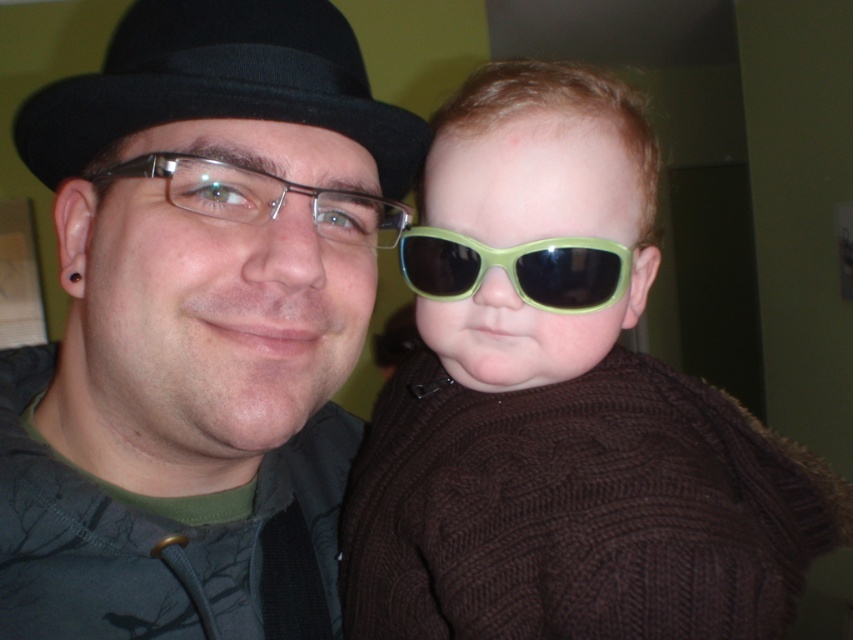
Who is positioned more to the right, matte black hat at upper left or green plastic sunglasses at center?

Positioned to the right is green plastic sunglasses at center.

The width and height of the screenshot is (853, 640). In order to click on matte black hat at upper left in this screenshot , I will do `click(198, 324)`.

The image size is (853, 640). What do you see at coordinates (198, 324) in the screenshot?
I see `matte black hat at upper left` at bounding box center [198, 324].

The image size is (853, 640). In order to click on matte black hat at upper left in this screenshot , I will do `click(198, 324)`.

Which of these two, green matte sunglasses at center or green plastic sunglasses at center, stands taller?

green matte sunglasses at center is taller.

Who is more forward, [601,362] or [508,248]?

Point [508,248] is in front.

At what (x,y) coordinates should I click in order to perform the action: click on green matte sunglasses at center. Please return your answer as a coordinate pair (x, y). Looking at the image, I should click on (561, 404).

In the scene shown: Between green matte sunglasses at center and clear plastic glasses at center, which one is positioned higher?

clear plastic glasses at center is higher up.

Which is behind, point (677, 609) or point (276, 209)?

The point (677, 609) is behind.

Which is behind, point (566, 172) or point (219, 192)?

Positioned behind is point (566, 172).

This screenshot has width=853, height=640. I want to click on green matte sunglasses at center, so click(x=561, y=404).